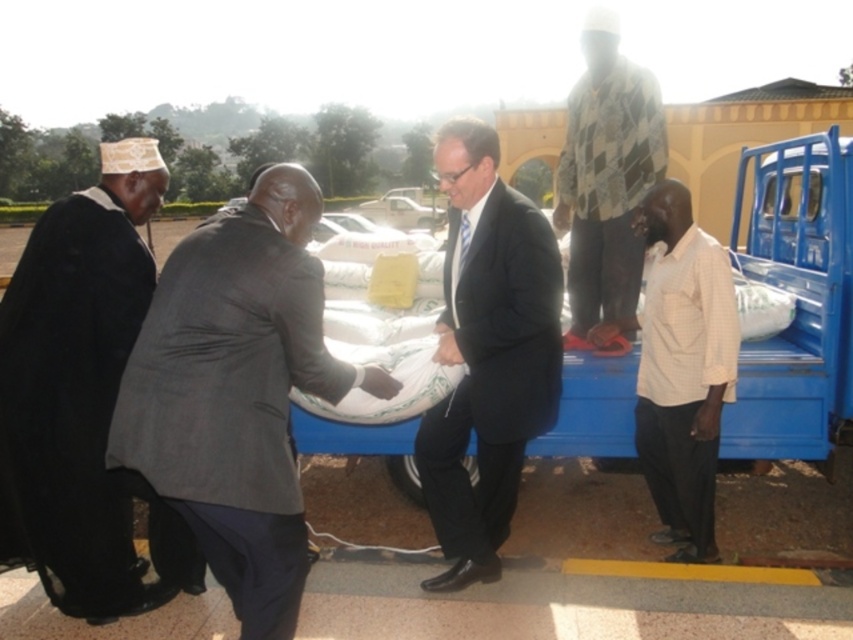
Question: Is white checkered shirt at right closer to the viewer compared to checkered fabric shirt at upper center?

Choices:
 (A) no
 (B) yes

Answer: (B)

Question: Which object is farther from the camera taking this photo?

Choices:
 (A) checkered fabric shirt at upper center
 (B) black woolen robe at left

Answer: (A)

Question: Does black woolen robe at left come behind checkered fabric shirt at upper center?

Choices:
 (A) yes
 (B) no

Answer: (B)

Question: Does gray wool suit at center have a lesser width compared to white checkered shirt at right?

Choices:
 (A) yes
 (B) no

Answer: (B)

Question: Which point is farther from the camera taking this photo?

Choices:
 (A) (608, 104)
 (B) (250, 486)
 (C) (45, 349)

Answer: (A)

Question: Which of these objects is positioned farthest from the white checkered shirt at right?

Choices:
 (A) gray wool suit at center
 (B) black woolen robe at left
 (C) matte black suit at center

Answer: (B)